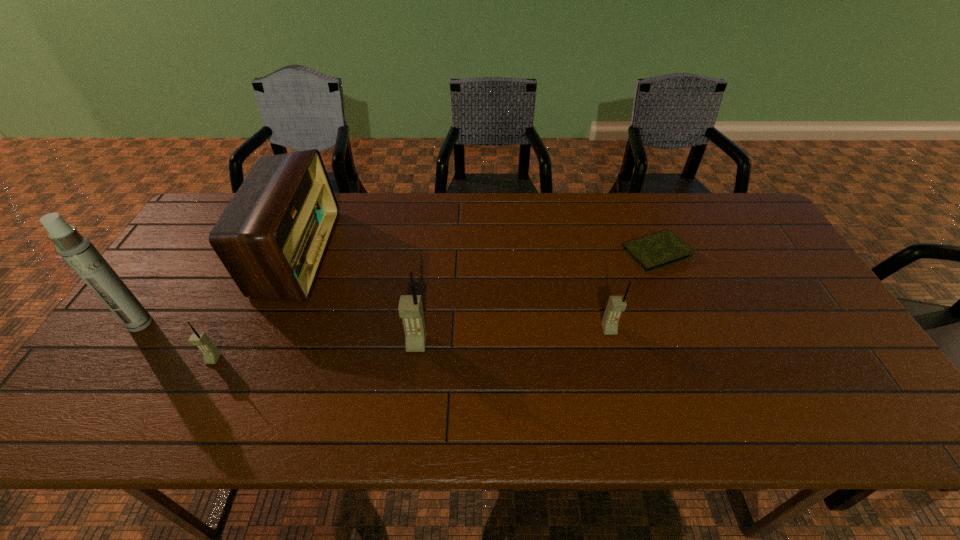
Please point a spot to add another cellular telephone on the right. Please provide its 2D coordinates. Your answer should be formatted as a tuple, i.e. [(x, y)], where the tuple contains the x and y coordinates of a point satisfying the conditions above.

[(791, 316)]